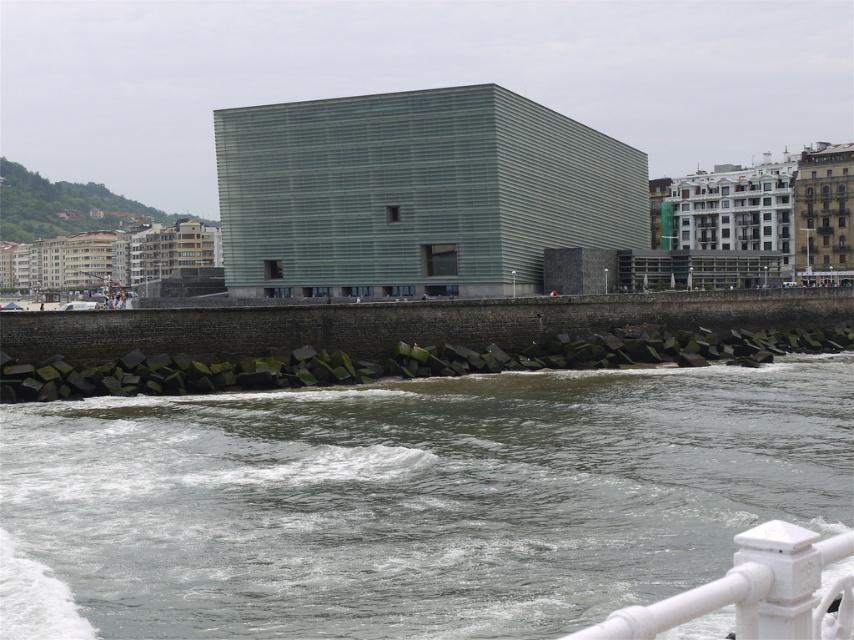
Does dark gray water at lower center appear under white painted metal railing at lower right?

Actually, dark gray water at lower center is above white painted metal railing at lower right.

Between point (89, 486) and point (741, 595), which one is positioned behind?

The point (89, 486) is more distant.

This screenshot has width=854, height=640. I want to click on dark gray water at lower center, so click(408, 499).

The height and width of the screenshot is (640, 854). In order to click on dark gray water at lower center in this screenshot , I will do `click(408, 499)`.